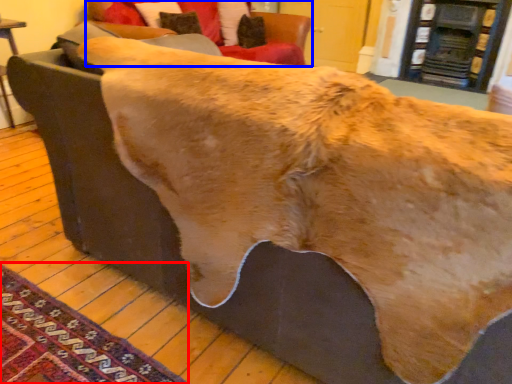
Question: Which object appears farthest to the camera in this image, mat (highlighted by a red box) or studio couch (highlighted by a blue box)?

Choices:
 (A) mat
 (B) studio couch

Answer: (B)